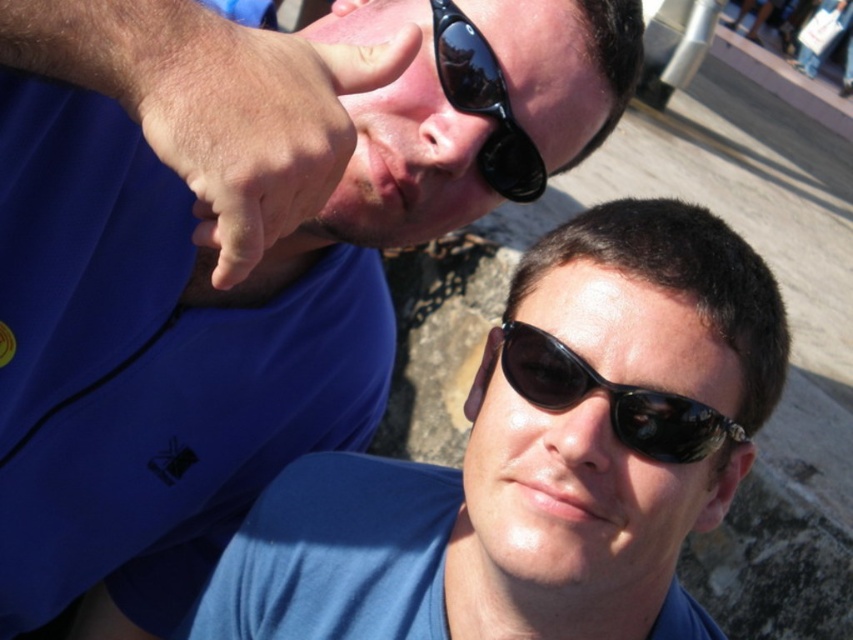
Question: From the image, what is the correct spatial relationship of matte blue shirt at center in relation to dry skin at upper center?

Choices:
 (A) below
 (B) above

Answer: (A)

Question: Estimate the real-world distances between objects in this image. Which object is farther from the black reflective sunglasses at center?

Choices:
 (A) matte blue shirt at center
 (B) dry skin at upper center
 (C) matte black nose at upper center
 (D) matte black nose at center

Answer: (B)

Question: Which point is farther from the camera taking this photo?

Choices:
 (A) (695, 433)
 (B) (341, 6)
 (C) (496, 148)

Answer: (B)

Question: Considering the relative positions of black reflective sunglasses at center and black reflective sunglasses at upper center in the image provided, where is black reflective sunglasses at center located with respect to black reflective sunglasses at upper center?

Choices:
 (A) left
 (B) right

Answer: (B)

Question: Which point is farther from the camera taking this photo?

Choices:
 (A) (428, 132)
 (B) (345, 4)
 (C) (548, 438)
 (D) (287, 195)

Answer: (B)

Question: Is matte blue shirt at center positioned in front of dry skin at upper center?

Choices:
 (A) no
 (B) yes

Answer: (A)